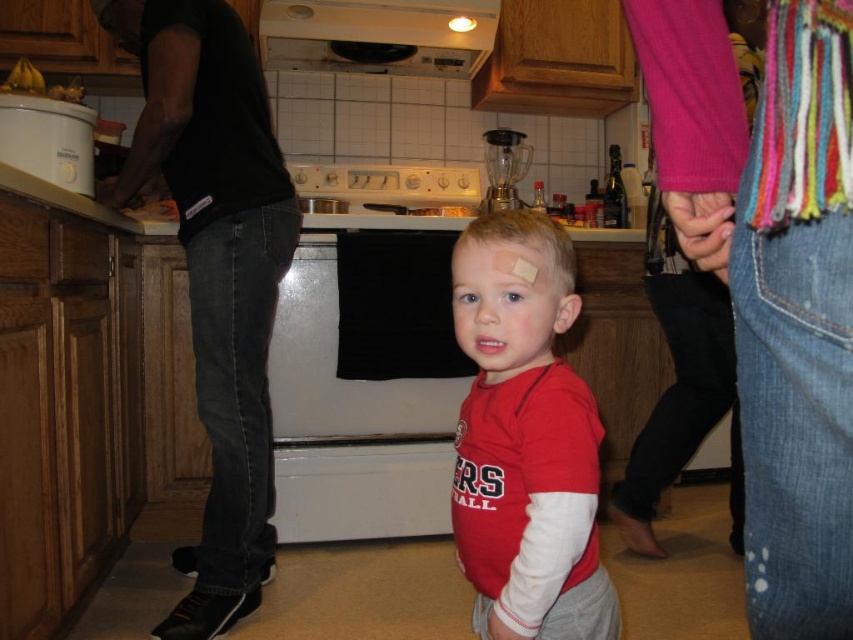
Question: Which object is closer to the camera taking this photo?

Choices:
 (A) white matte exhaust hood at upper center
 (B) red matte shirt at center
 (C) white glossy stove at center
 (D) white glossy oven at center

Answer: (B)

Question: Can you confirm if red matte shirt at center is positioned to the left of white matte exhaust hood at upper center?

Choices:
 (A) no
 (B) yes

Answer: (A)

Question: Is red matte shirt at center to the left of white matte exhaust hood at upper center from the viewer's perspective?

Choices:
 (A) yes
 (B) no

Answer: (B)

Question: Which point is closer to the camera?

Choices:
 (A) white glossy stove at center
 (B) white matte exhaust hood at upper center
 (C) white glossy oven at center

Answer: (C)

Question: Which object appears farthest from the camera in this image?

Choices:
 (A) white matte exhaust hood at upper center
 (B) white glossy oven at center
 (C) white glossy stove at center
 (D) red matte shirt at center

Answer: (C)

Question: Is white matte exhaust hood at upper center positioned at the back of white glossy stove at center?

Choices:
 (A) no
 (B) yes

Answer: (A)